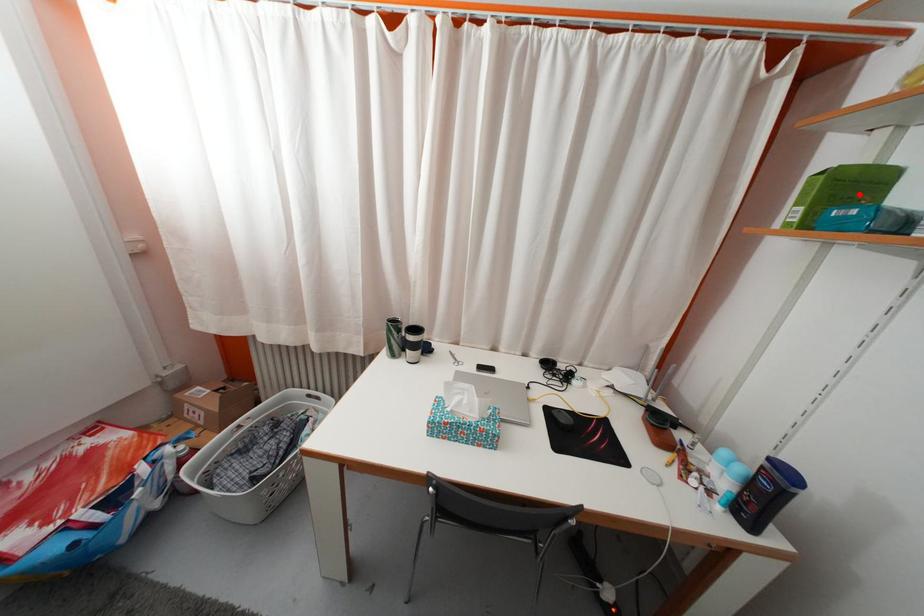
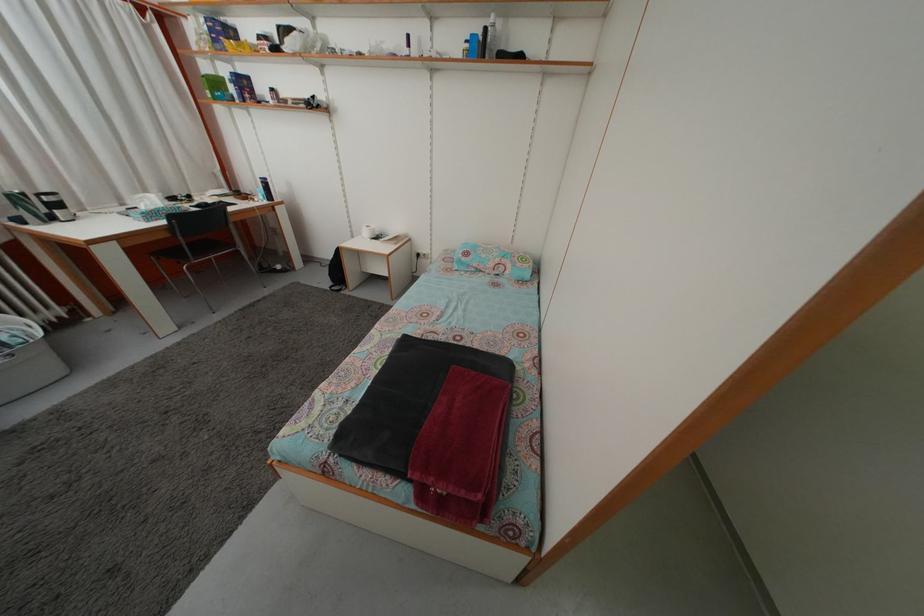
The point at the highlighted location is marked in the first image. Where is the corresponding point in the second image?

(223, 91)